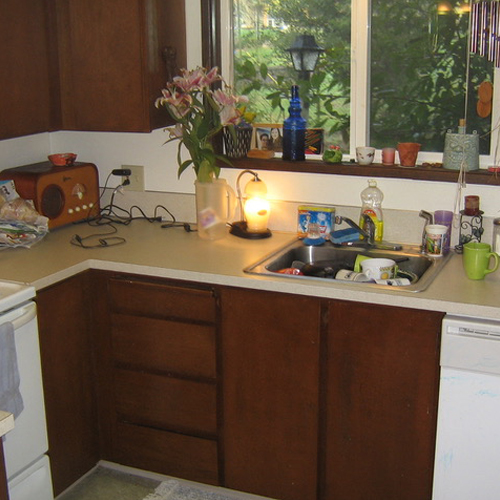
You are a GUI agent. You are given a task and a screenshot of the screen. Output one action in this format:
    pyautogui.click(x=<x>, y=<y>)
    Task: Click on the floor
    Image resolution: width=500 pixels, height=500 pixels.
    Given the screenshot: What is the action you would take?
    pyautogui.click(x=120, y=483)